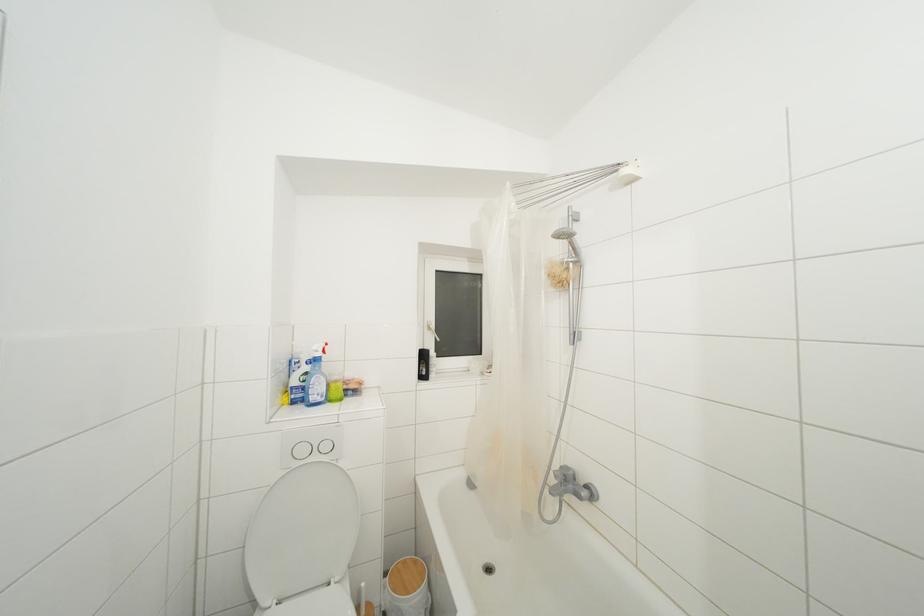
Identify the location of toilet brush handle. This screenshot has height=616, width=924. (362, 602).